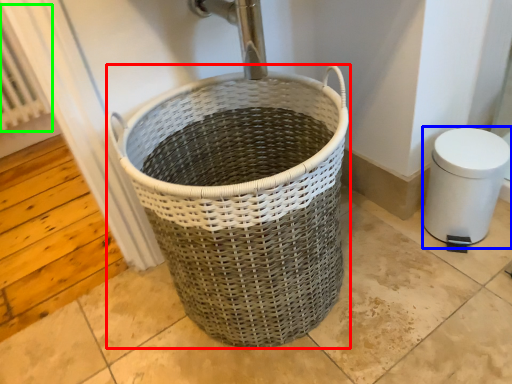
Question: Estimate the real-world distances between objects in this image. Which object is closer to waste container (highlighted by a red box), bidet (highlighted by a blue box) or radiator (highlighted by a green box)?

Choices:
 (A) bidet
 (B) radiator

Answer: (A)